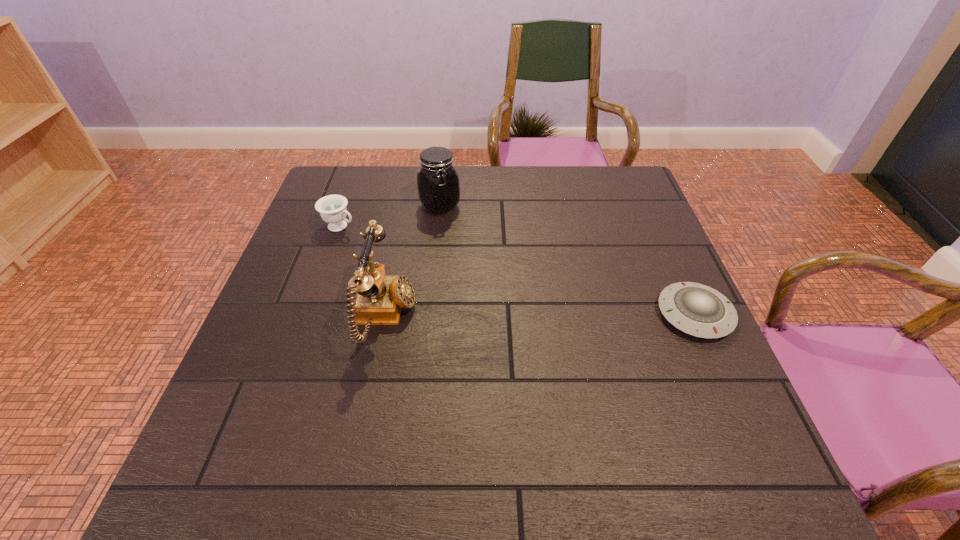
This screenshot has width=960, height=540. I want to click on free space on the desktop that is between the telephone and the rightmost object and is positioned on the side of the second shortest object with the handle, so click(527, 315).

Where is `vacant space on the desktop that is between the telephone and the saucer and is positioned on the lid of the jar`? Image resolution: width=960 pixels, height=540 pixels. vacant space on the desktop that is between the telephone and the saucer and is positioned on the lid of the jar is located at coordinates (585, 315).